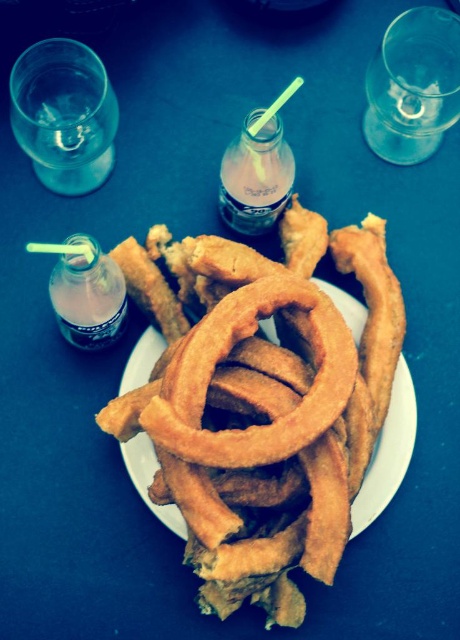
Is golden crispy onion rings at center bigger than translucent plastic bottle at left?

Correct, golden crispy onion rings at center is larger in size than translucent plastic bottle at left.

Is point (322, 234) closer to viewer compared to point (56, 307)?

That is False.

Identify the location of golden crispy onion rings at center. The height and width of the screenshot is (640, 460). (262, 403).

Between translucent plastic bottle at center and translucent plastic bottle at left, which one has more height?

Standing taller between the two is translucent plastic bottle at left.

Does point (239, 138) come closer to viewer compared to point (120, 326)?

Yes, point (239, 138) is closer to viewer.

I want to click on translucent plastic bottle at center, so click(x=256, y=176).

Is point (180, 470) farther from viewer compared to point (257, 177)?

No, it is in front of (257, 177).

Between point (149, 250) and point (248, 182), which one is positioned in front?

Point (248, 182) is in front.

Who is more distant from viewer, (233, 392) or (257, 170)?

The point (257, 170) is behind.

This screenshot has width=460, height=640. In order to click on golden crispy onion rings at center in this screenshot , I will do coord(262,403).